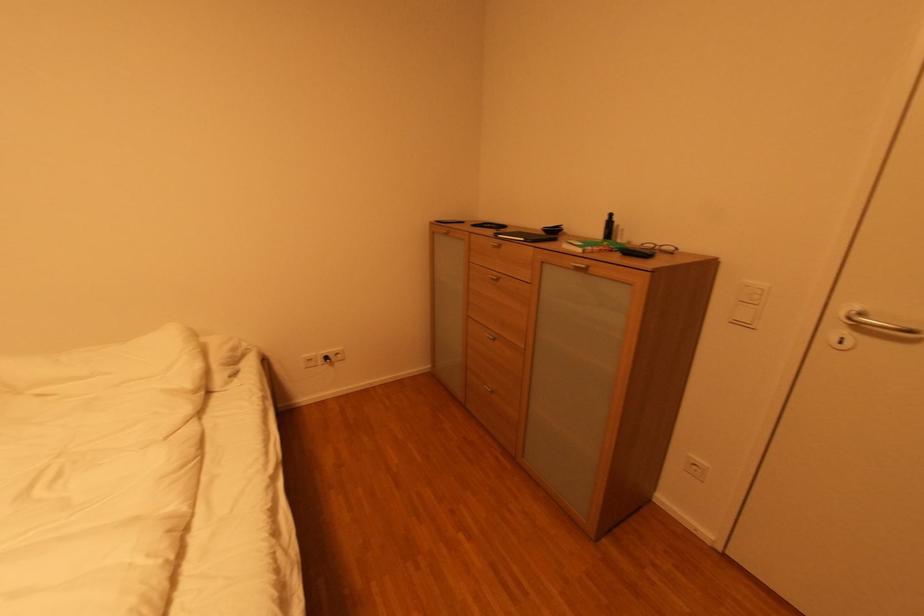
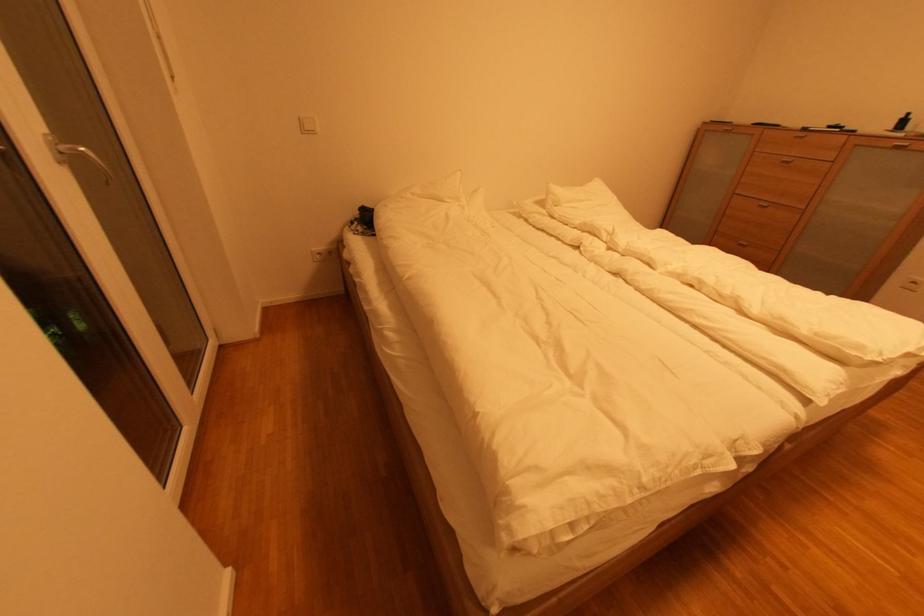
The point at (499, 281) is marked in the first image. Where is the corresponding point in the second image?

(789, 163)